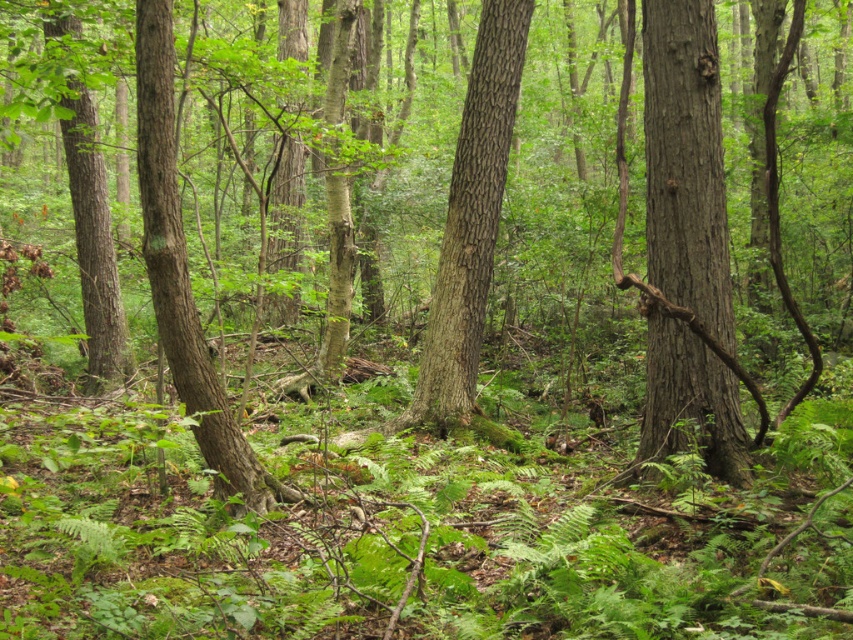
Does smooth brown tree trunk at center appear under smooth bark tree at center?

Yes.

Can you confirm if smooth brown tree trunk at center is thinner than smooth bark tree at center?

Yes.

Does point (683, 154) come farther from viewer compared to point (451, 356)?

No, it is not.

The image size is (853, 640). What are the coordinates of `smooth brown tree trunk at center` in the screenshot? It's located at (685, 163).

Does smooth bark tree at center have a larger size compared to rough bark tree at left?

Actually, smooth bark tree at center might be smaller than rough bark tree at left.

Image resolution: width=853 pixels, height=640 pixels. I want to click on smooth bark tree at center, so click(469, 221).

Is smooth brown tree trunk at center bigger than rough bark tree at left?

No.

Which is in front, point (717, 141) or point (144, 189)?

Point (144, 189) is more forward.

Image resolution: width=853 pixels, height=640 pixels. What do you see at coordinates (685, 163) in the screenshot?
I see `smooth brown tree trunk at center` at bounding box center [685, 163].

Where is `smooth brown tree trunk at center`? This screenshot has height=640, width=853. smooth brown tree trunk at center is located at coordinates (685, 163).